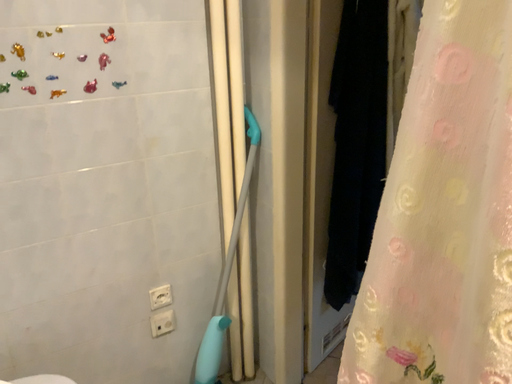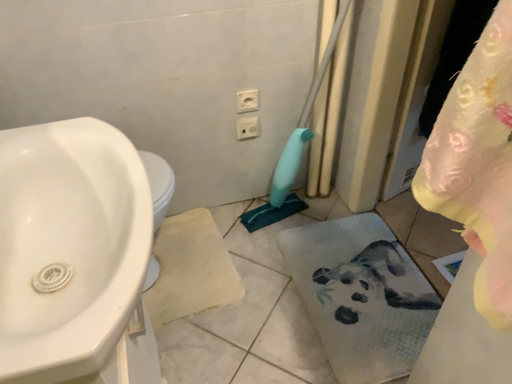
Question: Which way did the camera rotate in the video?

Choices:
 (A) rotated left
 (B) rotated right

Answer: (A)